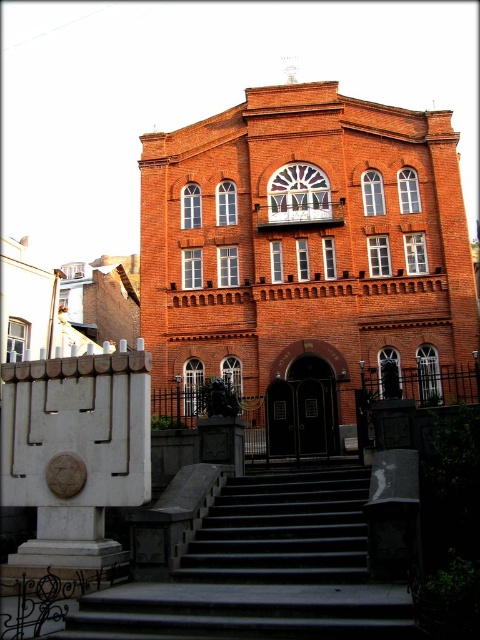
Question: Which point appears closest to the camera in this image?

Choices:
 (A) (328, 497)
 (B) (391, 291)

Answer: (A)

Question: Can you confirm if red brick church at center is positioned to the left of black stone stairs at center?

Choices:
 (A) no
 (B) yes

Answer: (A)

Question: Among these objects, which one is farthest from the camera?

Choices:
 (A) black stone stairs at center
 (B) red brick church at center

Answer: (B)

Question: Is red brick church at center thinner than black stone stairs at center?

Choices:
 (A) yes
 (B) no

Answer: (B)

Question: Is red brick church at center bigger than black stone stairs at center?

Choices:
 (A) no
 (B) yes

Answer: (B)